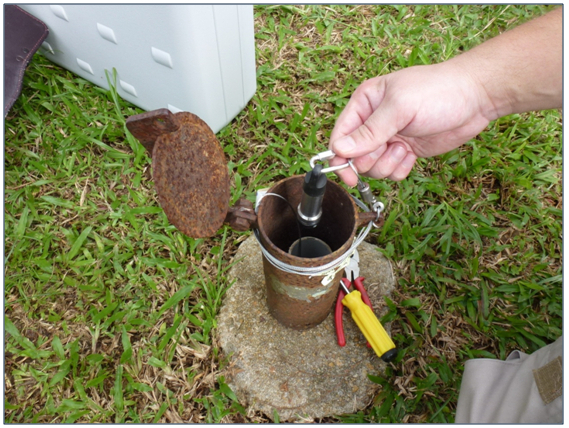
This screenshot has height=428, width=569. What are the coordinates of `metal cup lid on hinge` in the screenshot? It's located at (189, 186).